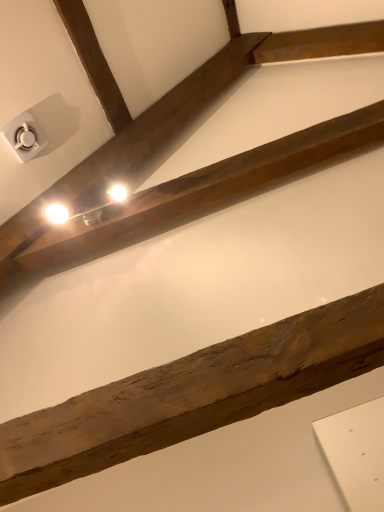
Question: Should I look upward or downward to see white plastic/light switch at upper left?

Choices:
 (A) up
 (B) down

Answer: (A)